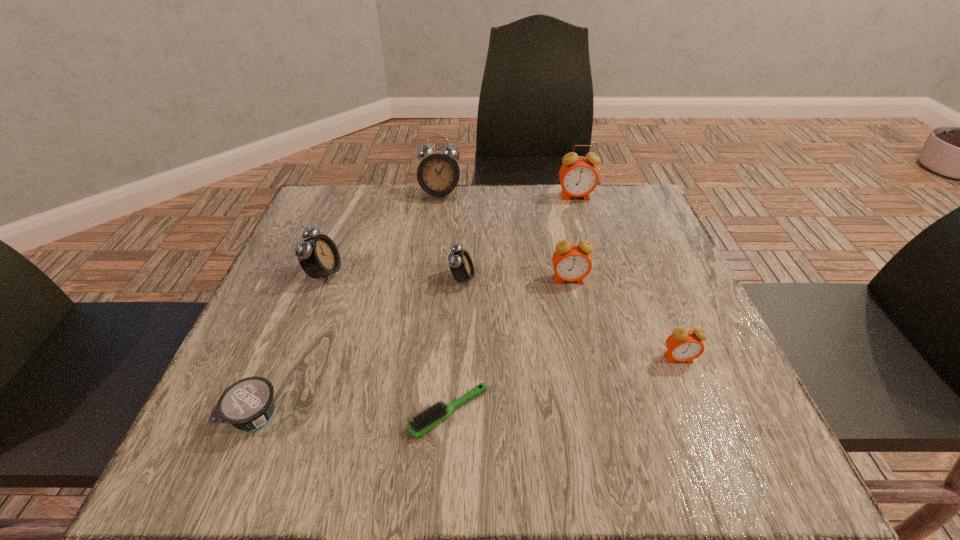
You are a GUI agent. You are given a task and a screenshot of the screen. Output one action in this format:
    pyautogui.click(x=<x>, y=<y>)
    Task: Click on the hairbrush situated at the near edge
    The height and width of the screenshot is (540, 960).
    Given the screenshot: What is the action you would take?
    pyautogui.click(x=426, y=420)

The height and width of the screenshot is (540, 960). Find the location of `alarm clock that is at the left edge`. alarm clock that is at the left edge is located at coordinates (318, 256).

I want to click on yogurt located at the left edge, so click(248, 404).

Where is `object at the near left corner`? This screenshot has width=960, height=540. object at the near left corner is located at coordinates (248, 404).

Locate an element on the screen. This screenshot has width=960, height=540. object located in the far right corner section of the desktop is located at coordinates (578, 176).

In the image, there is a desktop. Where is `free space at the far edge`? free space at the far edge is located at coordinates (500, 218).

In order to click on free spot at the left edge of the desktop in this screenshot , I will do `click(339, 298)`.

The image size is (960, 540). I want to click on free space at the right edge of the desktop, so click(647, 269).

Find the location of a particular element. The image size is (960, 540). free space at the far left corner of the desktop is located at coordinates (331, 224).

Find the location of `vacant space at the far right corner of the desktop`. vacant space at the far right corner of the desktop is located at coordinates (590, 200).